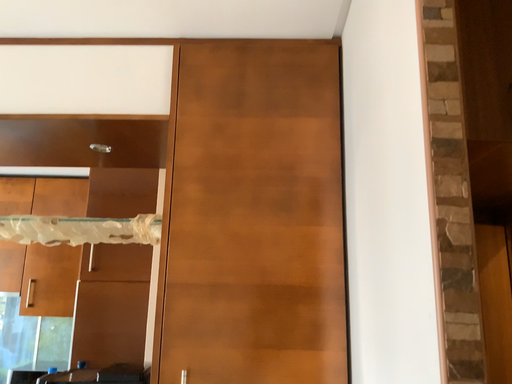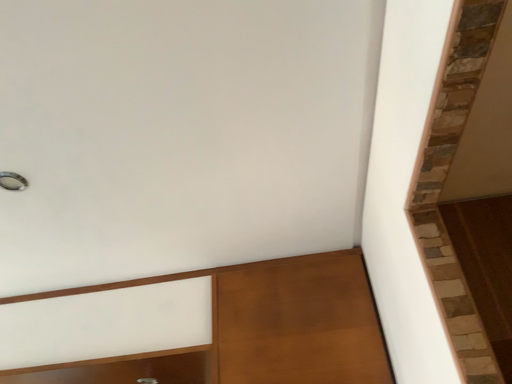
Question: How did the camera likely rotate when shooting the video?

Choices:
 (A) rotated right
 (B) rotated left

Answer: (B)